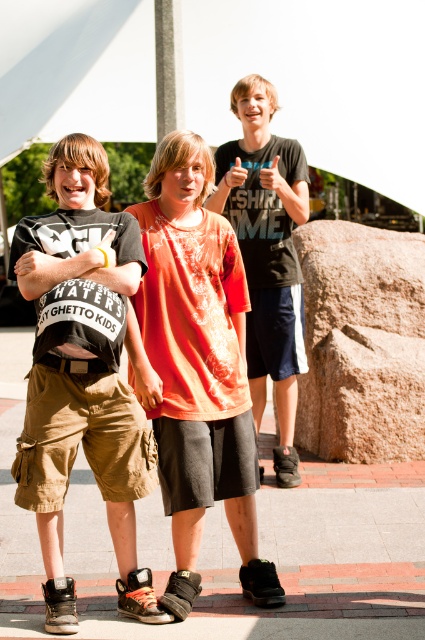
Question: Observing the image, what is the correct spatial positioning of tie-dye t-shirt at center in reference to matte black t-shirt at upper center?

Choices:
 (A) left
 (B) right

Answer: (A)

Question: Is white fabric canopy at upper center thinner than tie-dye t-shirt at center?

Choices:
 (A) yes
 (B) no

Answer: (B)

Question: Which point is farther from the camera taking this photo?

Choices:
 (A) (198, 352)
 (B) (346, 172)
 (C) (64, 410)
 (D) (289, 317)

Answer: (B)

Question: Which object is farther from the camera taking this photo?

Choices:
 (A) white fabric canopy at upper center
 (B) tie-dye t-shirt at center

Answer: (A)

Question: Which of the following is the closest to the observer?

Choices:
 (A) [x=337, y=339]
 (B) [x=345, y=122]
 (C) [x=249, y=476]

Answer: (C)

Question: Can you confirm if matte black t-shirt at left is thinner than matte black t-shirt at upper center?

Choices:
 (A) no
 (B) yes

Answer: (A)